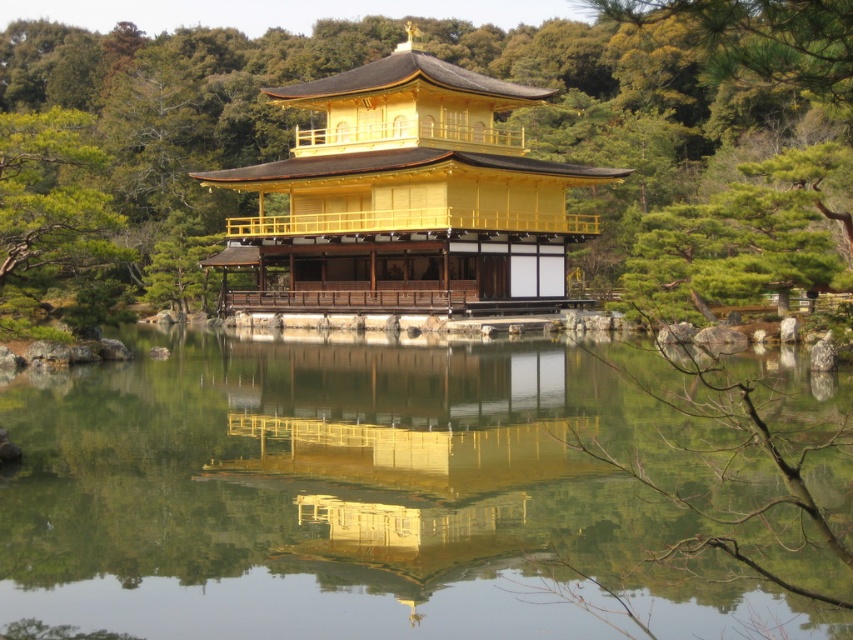
Can you confirm if transparent glass water at center is smaller than golden polished wood pagoda at center?

Indeed, transparent glass water at center has a smaller size compared to golden polished wood pagoda at center.

Does transparent glass water at center have a lesser height compared to golden polished wood pagoda at center?

Indeed, transparent glass water at center has a lesser height compared to golden polished wood pagoda at center.

The width and height of the screenshot is (853, 640). What do you see at coordinates (355, 499) in the screenshot? I see `transparent glass water at center` at bounding box center [355, 499].

The height and width of the screenshot is (640, 853). I want to click on transparent glass water at center, so click(x=355, y=499).

Does point (138, 97) come behind point (503, 214)?

Yes, it is.

Can you confirm if green leafy tree at center is positioned below golden polished wood pagoda at center?

No.

Where is `green leafy tree at center`? green leafy tree at center is located at coordinates (465, 150).

Image resolution: width=853 pixels, height=640 pixels. In order to click on green leafy tree at center in this screenshot , I will do `click(465, 150)`.

Is transparent glass water at center thinner than green leafy tree at center?

Yes, transparent glass water at center is thinner than green leafy tree at center.

Does transparent glass water at center appear under green leafy tree at center?

Indeed, transparent glass water at center is positioned under green leafy tree at center.

You are a GUI agent. You are given a task and a screenshot of the screen. Output one action in this format:
    pyautogui.click(x=<x>, y=<y>)
    Task: Click on the transparent glass water at center
    
    Given the screenshot: What is the action you would take?
    pyautogui.click(x=355, y=499)